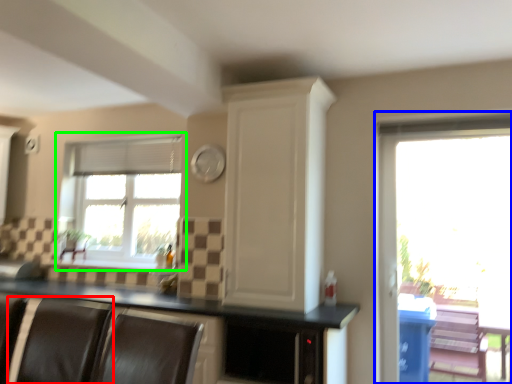
Question: Which object is positioned closest to armchair (highlighted by a red box)? Select from window (highlighted by a blue box) and window (highlighted by a green box).

Choices:
 (A) window
 (B) window

Answer: (B)